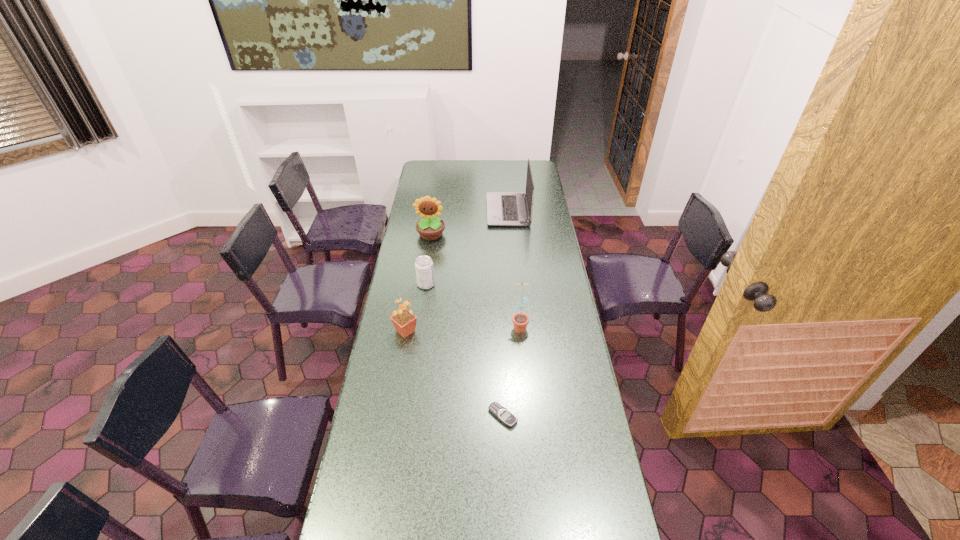
Where is `vacant area that lies between the farthest sunflower and the rightmost sunflower`? vacant area that lies between the farthest sunflower and the rightmost sunflower is located at coordinates (475, 280).

Identify the location of unoccupied position between the fourth nearest object and the nearest object. (465, 350).

Where is `free space between the laptop computer and the nearest object`? Image resolution: width=960 pixels, height=540 pixels. free space between the laptop computer and the nearest object is located at coordinates (505, 313).

Locate an element on the screen. The height and width of the screenshot is (540, 960). vacant region between the rightmost sunflower and the laptop computer is located at coordinates (514, 268).

Where is `free space between the farthest sunflower and the rightmost sunflower`? This screenshot has height=540, width=960. free space between the farthest sunflower and the rightmost sunflower is located at coordinates (475, 280).

Find the location of a particular element. The height and width of the screenshot is (540, 960). vacant space in between the nearest object and the rightmost sunflower is located at coordinates (511, 370).

Locate which object is the fourth closest to the farthest sunflower. Please provide its 2D coordinates. Your answer should be formatted as a tuple, i.e. [(x, y)], where the tuple contains the x and y coordinates of a point satisfying the conditions above.

[(520, 320)]

Select which object appears as the fifth closest to the rightmost sunflower. Please provide its 2D coordinates. Your answer should be formatted as a tuple, i.e. [(x, y)], where the tuple contains the x and y coordinates of a point satisfying the conditions above.

[(503, 208)]

At what (x,y) coordinates should I click in order to perform the action: click on the second closest sunflower to the farthest sunflower. Please return your answer as a coordinate pair (x, y). The image size is (960, 540). Looking at the image, I should click on (520, 320).

At what (x,y) coordinates should I click in order to perform the action: click on sunflower that is the second closest to the rightmost sunflower. Please return your answer as a coordinate pair (x, y). The height and width of the screenshot is (540, 960). Looking at the image, I should click on (430, 227).